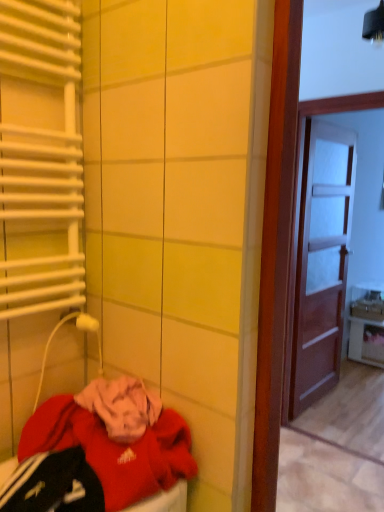
The image size is (384, 512). I want to click on white metallic radiator at left, so click(x=42, y=157).

Between white glossy cabinet at right and white metallic radiator at left, which one has larger size?

With larger size is white glossy cabinet at right.

You are a GUI agent. You are given a task and a screenshot of the screen. Output one action in this format:
    pyautogui.click(x=<x>, y=<y>)
    Task: Click on the shutter that appears in front of the white glossy cabinet at right
    
    Given the screenshot: What is the action you would take?
    pyautogui.click(x=42, y=157)

What's the angular difference between white glossy cabinet at right and white metallic radiator at left's facing directions?

0.313 degrees.

From a real-world perspective, does white glossy cabinet at right stand above white metallic radiator at left?

Actually, white glossy cabinet at right is physically below white metallic radiator at left in the real world.

Which of these two, white metallic radiator at left or red fleece sweatshirt at lower left, stands shorter?

Standing shorter between the two is red fleece sweatshirt at lower left.

Measure the distance from white metallic radiator at left to red fleece sweatshirt at lower left.

They are 20.48 inches apart.

How different are the orientations of white metallic radiator at left and red fleece sweatshirt at lower left in degrees?

The angle between the facing direction of white metallic radiator at left and the facing direction of red fleece sweatshirt at lower left is 0.775 degrees.

Considering the sizes of white metallic radiator at left and red fleece sweatshirt at lower left in the image, is white metallic radiator at left wider or thinner than red fleece sweatshirt at lower left?

In the image, white metallic radiator at left appears to be more narrow than red fleece sweatshirt at lower left.

This screenshot has width=384, height=512. There is a brown wooden door at right. Identify the location of shutter above it (from a real-world perspective). (42, 157).

Could you tell me if white metallic radiator at left is turned towards brown wooden door at right?

No, white metallic radiator at left is not oriented towards brown wooden door at right.

Is white metallic radiator at left positioned beyond the bounds of brown wooden door at right?

white metallic radiator at left is positioned outside brown wooden door at right.

Is white metallic radiator at left taller or shorter than brown wooden door at right?

Clearly, white metallic radiator at left is shorter compared to brown wooden door at right.

Which of these two, brown wooden door at right or white metallic radiator at left, stands shorter?

With less height is white metallic radiator at left.

Considering the relative sizes of brown wooden door at right and white metallic radiator at left in the image provided, is brown wooden door at right thinner than white metallic radiator at left?

Correct, the width of brown wooden door at right is less than that of white metallic radiator at left.

Is brown wooden door at right not within white metallic radiator at left?

Yes, brown wooden door at right is located beyond the bounds of white metallic radiator at left.

Is brown wooden door at right far from white metallic radiator at left?

Yes, brown wooden door at right and white metallic radiator at left are quite far apart.

Between white glossy cabinet at right and red fleece sweatshirt at lower left, which one appears on the left side from the viewer's perspective?

red fleece sweatshirt at lower left is more to the left.

From the picture: From a real-world perspective, is white glossy cabinet at right positioned under red fleece sweatshirt at lower left based on gravity?

Yes.

From the image's perspective, who appears lower, white glossy cabinet at right or red fleece sweatshirt at lower left?

white glossy cabinet at right.

Does white glossy cabinet at right have a lesser height compared to red fleece sweatshirt at lower left?

In fact, white glossy cabinet at right may be taller than red fleece sweatshirt at lower left.

Who is smaller, red fleece sweatshirt at lower left or white metallic radiator at left?

white metallic radiator at left.

Choose the correct answer: Is red fleece sweatshirt at lower left inside white metallic radiator at left or outside it?

red fleece sweatshirt at lower left is not inside white metallic radiator at left, it's outside.

Is red fleece sweatshirt at lower left oriented away from white metallic radiator at left?

No.

The image size is (384, 512). Identify the location of cabinetry below the red fleece sweatshirt at lower left (from the image's perspective). (366, 341).

Which object is wider, red fleece sweatshirt at lower left or white glossy cabinet at right?

Wider between the two is red fleece sweatshirt at lower left.

Is red fleece sweatshirt at lower left not close to white glossy cabinet at right?

Absolutely, red fleece sweatshirt at lower left is distant from white glossy cabinet at right.

Who is more distant, red fleece sweatshirt at lower left or white glossy cabinet at right?

white glossy cabinet at right is further from the camera.

The width and height of the screenshot is (384, 512). Identify the location of cabinetry below the white metallic radiator at left (from a real-world perspective). (366, 341).

Identify the location of shutter located behind the red fleece sweatshirt at lower left. (42, 157).

Which object lies nearer to the anchor point red fleece sweatshirt at lower left, white glossy cabinet at right or white metallic radiator at left?

Based on the image, white metallic radiator at left appears to be nearer to red fleece sweatshirt at lower left.

Based on their spatial positions, is white metallic radiator at left or white glossy cabinet at right closer to red fleece sweatshirt at lower left?

white metallic radiator at left.

Based on their spatial positions, is brown wooden door at right or white metallic radiator at left closer to red fleece sweatshirt at lower left?

Among the two, white metallic radiator at left is located nearer to red fleece sweatshirt at lower left.

Which object lies further to the anchor point white glossy cabinet at right, red fleece sweatshirt at lower left or white metallic radiator at left?

white metallic radiator at left lies further to white glossy cabinet at right than the other object.

Looking at the image, which one is located closer to brown wooden door at right, white metallic radiator at left or white glossy cabinet at right?

white glossy cabinet at right is positioned closer to the anchor brown wooden door at right.

From the image, which object appears to be nearer to brown wooden door at right, white glossy cabinet at right or red fleece sweatshirt at lower left?

white glossy cabinet at right is positioned closer to the anchor brown wooden door at right.

Which object lies nearer to the anchor point white metallic radiator at left, white glossy cabinet at right or brown wooden door at right?

brown wooden door at right lies closer to white metallic radiator at left than the other object.

When comparing their distances from red fleece sweatshirt at lower left, does brown wooden door at right or white glossy cabinet at right seem closer?

brown wooden door at right is closer to red fleece sweatshirt at lower left.

The width and height of the screenshot is (384, 512). Identify the location of shutter positioned between red fleece sweatshirt at lower left and white glossy cabinet at right from near to far. (42, 157).

This screenshot has width=384, height=512. Find the location of `door between white metallic radiator at left and white glossy cabinet at right in the front-back direction`. door between white metallic radiator at left and white glossy cabinet at right in the front-back direction is located at coordinates (321, 261).

In order to click on door between red fleece sweatshirt at lower left and white glossy cabinet at right from front to back in this screenshot , I will do `click(321, 261)`.

The image size is (384, 512). What are the coordinates of `shutter between red fleece sweatshirt at lower left and brown wooden door at right in the front-back direction` in the screenshot? It's located at (42, 157).